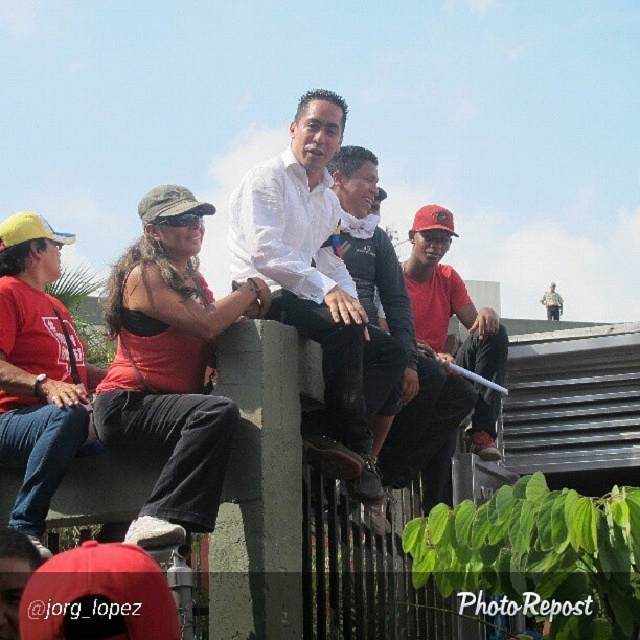
Question: Can you confirm if white cotton shirt at center is positioned to the left of matte black shirt at center?

Choices:
 (A) no
 (B) yes

Answer: (B)

Question: Is white cotton shirt at center wider than matte red shirt at center?

Choices:
 (A) no
 (B) yes

Answer: (A)

Question: Does white cotton shirt at center have a lesser width compared to matte black shirt at center?

Choices:
 (A) yes
 (B) no

Answer: (B)

Question: Which object appears closest to the camera in this image?

Choices:
 (A) white cotton shirt at center
 (B) matte red shirt at left
 (C) matte black shirt at center
 (D) matte red shirt at center

Answer: (B)

Question: Among these points, which one is farthest from the camera?

Choices:
 (A) (358, 449)
 (B) (413, 244)
 (C) (33, 508)
 (D) (390, 410)

Answer: (B)

Question: Which object is farther from the camera taking this photo?

Choices:
 (A) matte red shirt at center
 (B) white cotton shirt at center

Answer: (A)